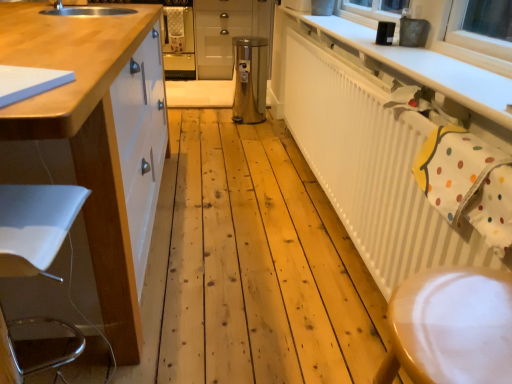
Question: Considering the relative positions of white textured radiator at upper right and white glossy cabinet at left, marked as the 1th cabinetry in a front-to-back arrangement, in the image provided, is white textured radiator at upper right to the left of white glossy cabinet at left, marked as the 1th cabinetry in a front-to-back arrangement, from the viewer's perspective?

Choices:
 (A) yes
 (B) no

Answer: (B)

Question: Is white textured radiator at upper right far away from white glossy cabinet at left, which appears as the first cabinetry when ordered from the bottom?

Choices:
 (A) no
 (B) yes

Answer: (A)

Question: Can you confirm if white textured radiator at upper right is thinner than white glossy cabinet at left, which appears as the first cabinetry when ordered from the bottom?

Choices:
 (A) yes
 (B) no

Answer: (A)

Question: Is white textured radiator at upper right bigger than white glossy cabinet at left, which appears as the first cabinetry when ordered from the bottom?

Choices:
 (A) yes
 (B) no

Answer: (B)

Question: From a real-world perspective, is white textured radiator at upper right located higher than white glossy cabinet at left, which appears as the first cabinetry when ordered from the bottom?

Choices:
 (A) no
 (B) yes

Answer: (A)

Question: Is white textured radiator at upper right shorter than white glossy cabinet at left, marked as the 1th cabinetry in a front-to-back arrangement?

Choices:
 (A) no
 (B) yes

Answer: (B)

Question: Considering the relative positions of white plastic swivel chair at left and stainless steel trash can at center in the image provided, is white plastic swivel chair at left behind stainless steel trash can at center?

Choices:
 (A) no
 (B) yes

Answer: (A)

Question: Is white plastic swivel chair at left oriented towards stainless steel trash can at center?

Choices:
 (A) no
 (B) yes

Answer: (B)

Question: Can you see white plastic swivel chair at left touching stainless steel trash can at center?

Choices:
 (A) no
 (B) yes

Answer: (A)

Question: Is white plastic swivel chair at left wider than stainless steel trash can at center?

Choices:
 (A) yes
 (B) no

Answer: (A)

Question: Is white plastic swivel chair at left far away from stainless steel trash can at center?

Choices:
 (A) yes
 (B) no

Answer: (A)

Question: Does white plastic swivel chair at left have a lesser height compared to stainless steel trash can at center?

Choices:
 (A) yes
 (B) no

Answer: (B)

Question: From a real-world perspective, is stainless steel trash can at center below white glossy cabinet at left, which appears as the first cabinetry when ordered from the bottom?

Choices:
 (A) yes
 (B) no

Answer: (A)